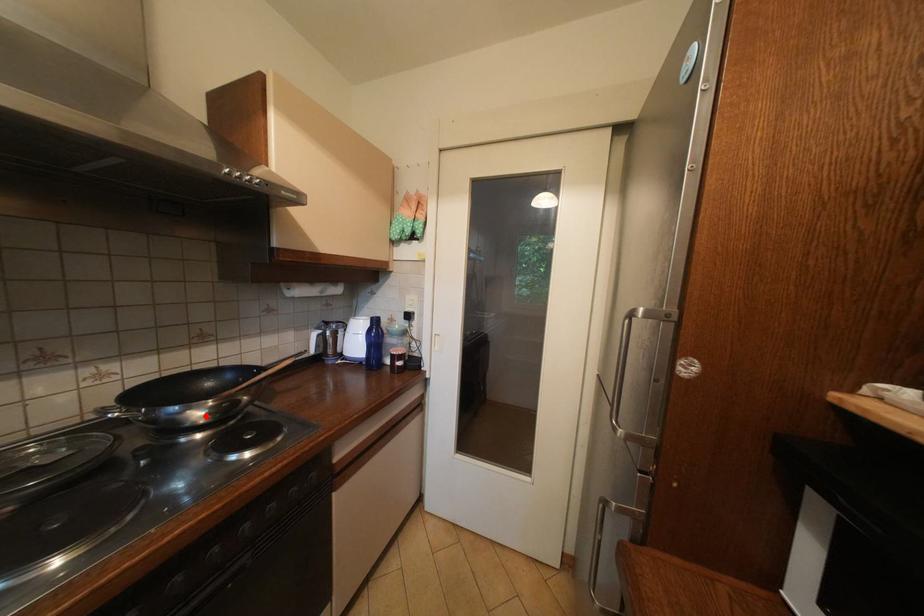
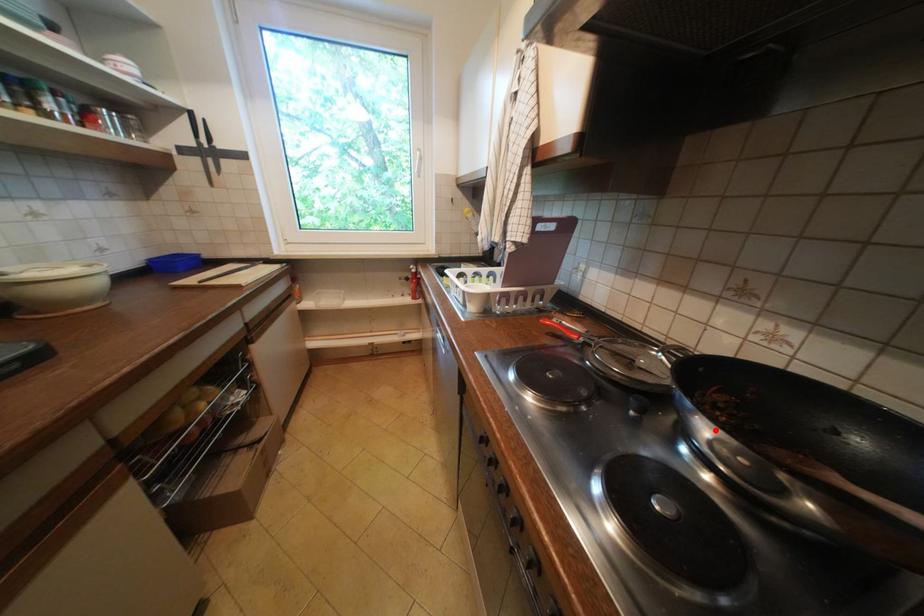
I am providing you with two images of the same scene from different viewpoints. A red point is marked on the first image and another point is marked on the second image. Does the point marked in image1 correspond to the same location as the one in image2?

Yes